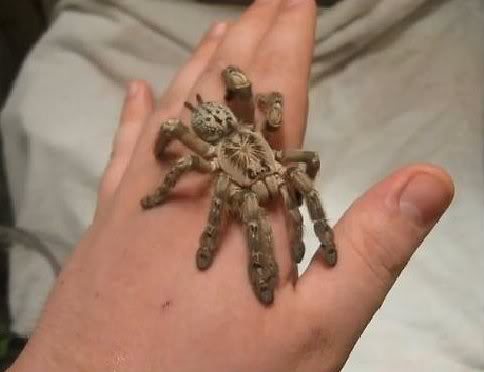
Locate an element on the screen. This screenshot has width=484, height=372. white cloth is located at coordinates (416, 101).